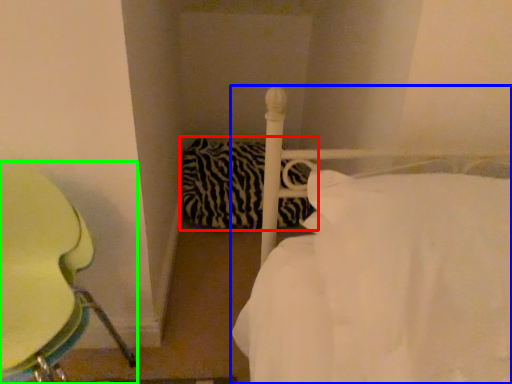
Question: Estimate the real-world distances between objects in this image. Which object is closer to pillow (highlighted by a red box), bed (highlighted by a blue box) or furniture (highlighted by a green box)?

Choices:
 (A) bed
 (B) furniture

Answer: (B)